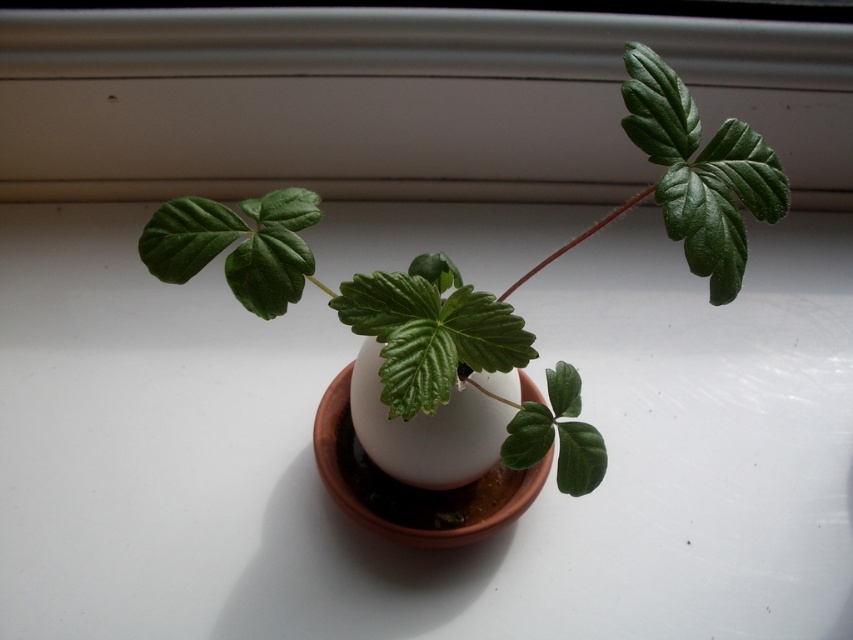
You are a gardener looking at the image of the plant in the terracotta pot. You need to place a small decorative stone at point (393, 100). Where exactly should you place it?

You should place the small decorative stone on the white matte window sill at upper center where point (393, 100) is located.

You are a gardener who wants to ensure the plant has enough space to grow. Given that the green matte plant at center is currently taller than the terracotta clay pot at center, what action should you take to accommodate its growth?

The green matte plant at center is taller than the terracotta clay pot at center, so you should transplant it to a larger pot that can accommodate its height and provide enough space for the roots to grow.

You are a gardener who wants to place a small statue between the white matte window sill at upper center and the terracotta clay pot at center. The statue is 18 inches wide. Will it fit between them?

The distance between the white matte window sill at upper center and the terracotta clay pot at center is 20.82 inches. Since the statue is 18 inches wide, it will fit between them as there is enough space.